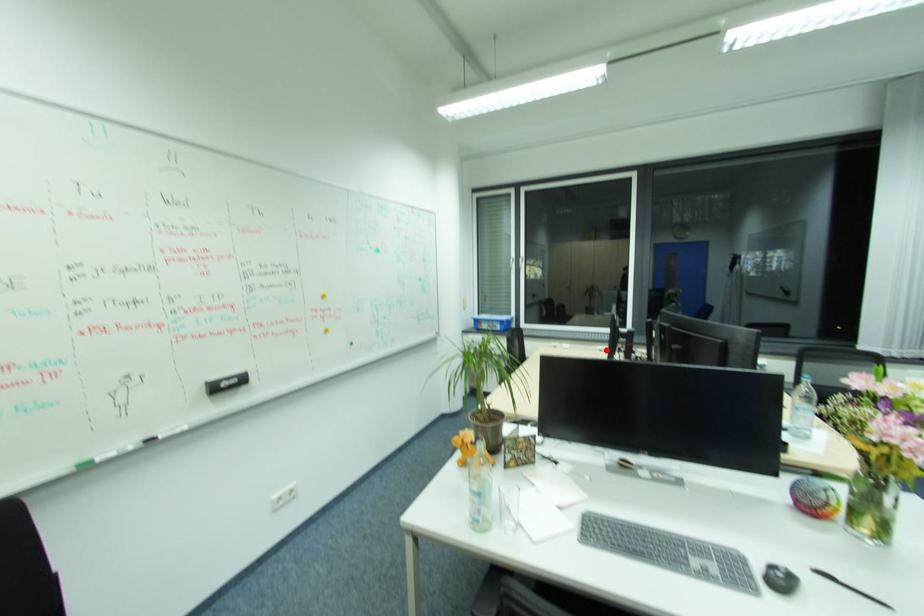
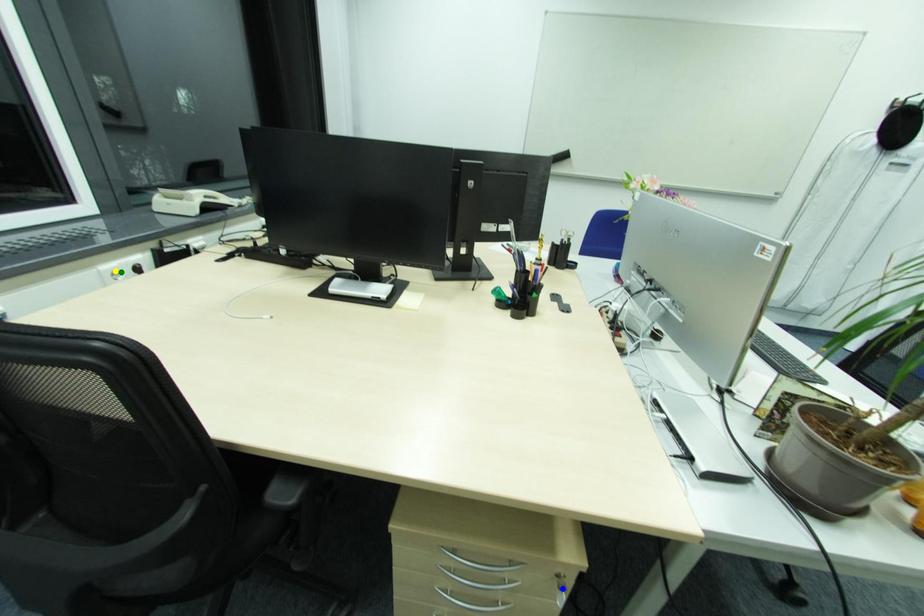
Question: I am providing you with two images of the same scene from different viewpoints. A red point is marked on the first image. You are given multiple points on the second image. Which mark in image 2 goes with the point in image 1?

Choices:
 (A) blue point
 (B) green point
 (C) yellow point

Answer: (B)